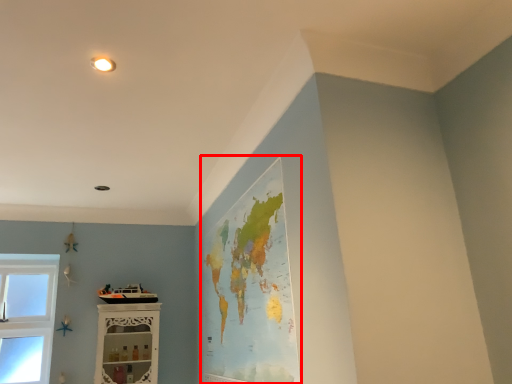
Question: In this image, where is map (annotated by the red box) located relative to shelf?

Choices:
 (A) right
 (B) left

Answer: (A)